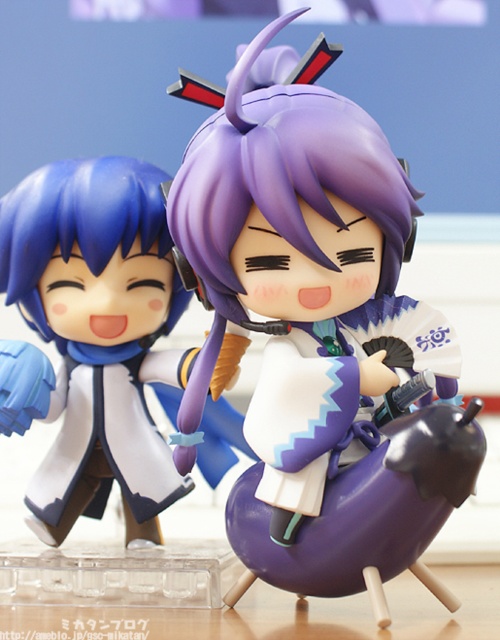
Question: Is purple matte figure at center smaller than matte blue doll at left?

Choices:
 (A) no
 (B) yes

Answer: (A)

Question: Which object is farther from the camera taking this photo?

Choices:
 (A) matte blue doll at left
 (B) purple matte figure at center

Answer: (A)

Question: Which of the following is the closest to the observer?

Choices:
 (A) purple matte figure at center
 (B) matte blue doll at left

Answer: (A)

Question: Can you confirm if purple matte figure at center is bigger than matte blue doll at left?

Choices:
 (A) no
 (B) yes

Answer: (B)

Question: From the image, what is the correct spatial relationship of purple matte figure at center in relation to matte blue doll at left?

Choices:
 (A) below
 (B) above

Answer: (B)